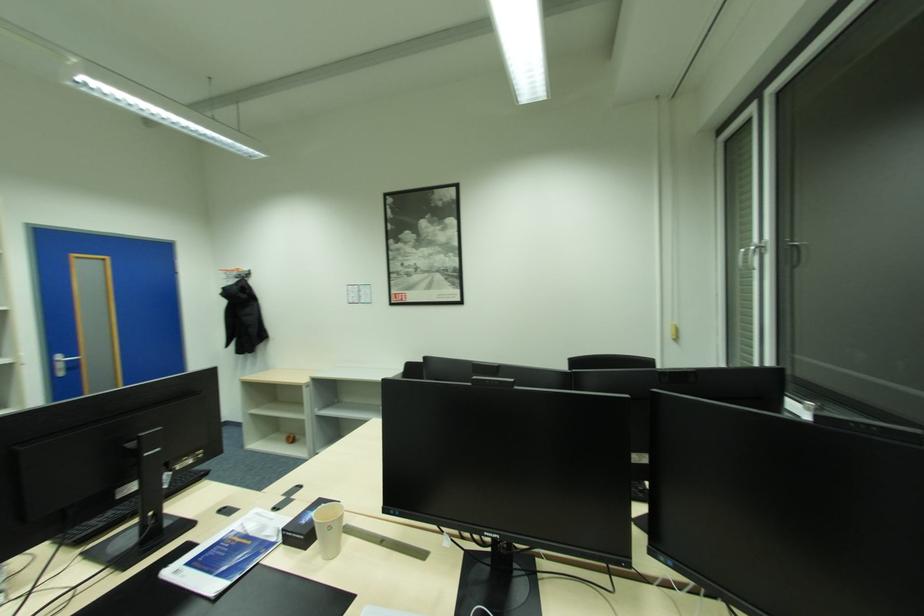
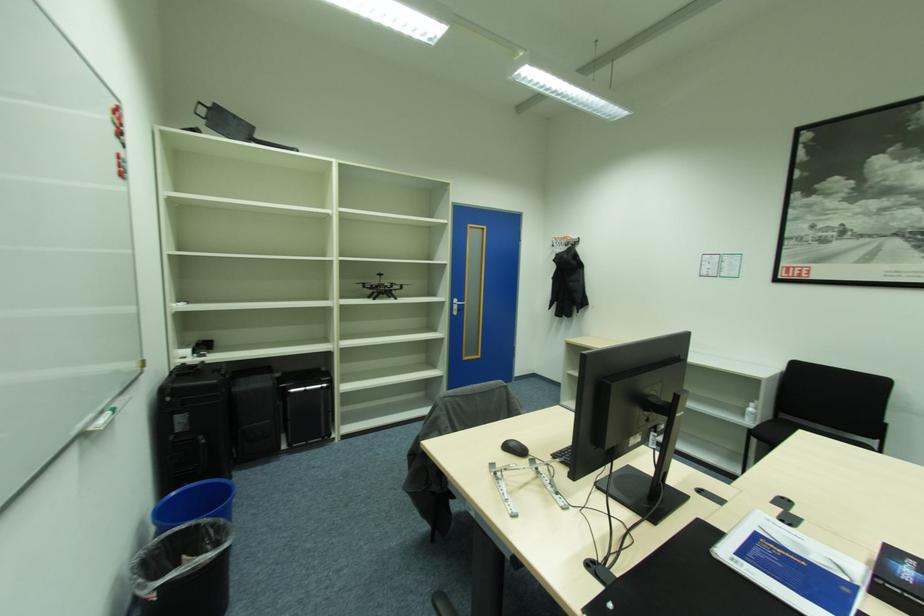
Question: Based on the continuous images, in which direction is the camera rotating? Reply with the corresponding letter.

Choices:
 (A) Left
 (B) Right
 (C) Up
 (D) Down

Answer: (A)